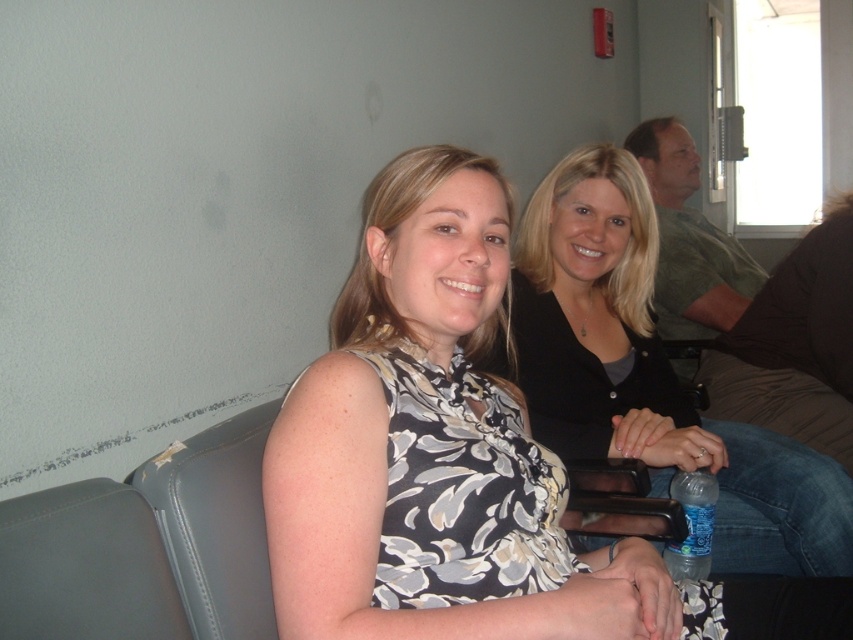
You are a photographer trying to capture a shot of the floral print blouse at center and the blue plastic bottle at lower right. Which object should you focus on first if you want to ensure both are in the frame without moving the camera?

The floral print blouse at center is located above the blue plastic bottle at lower right, so you should focus on the floral print blouse at center first to ensure both are in the frame without moving the camera.

You are a photographer trying to capture both the floral print blouse at center and the gray leather chair at lower left in a single frame. Which object should you focus on first to ensure both are in the frame?

The floral print blouse at center is larger than the gray leather chair at lower left, so you should focus on the floral print blouse at center first to ensure both fit within the frame.

You are a photographer trying to capture a candid shot of the two women in the scene. You notice the floral print blouse at center and the gray leather chair at lower left. Which object is covering the other?

The floral print blouse at center is positioned over the gray leather chair at lower left, so the blouse is covering the chair.